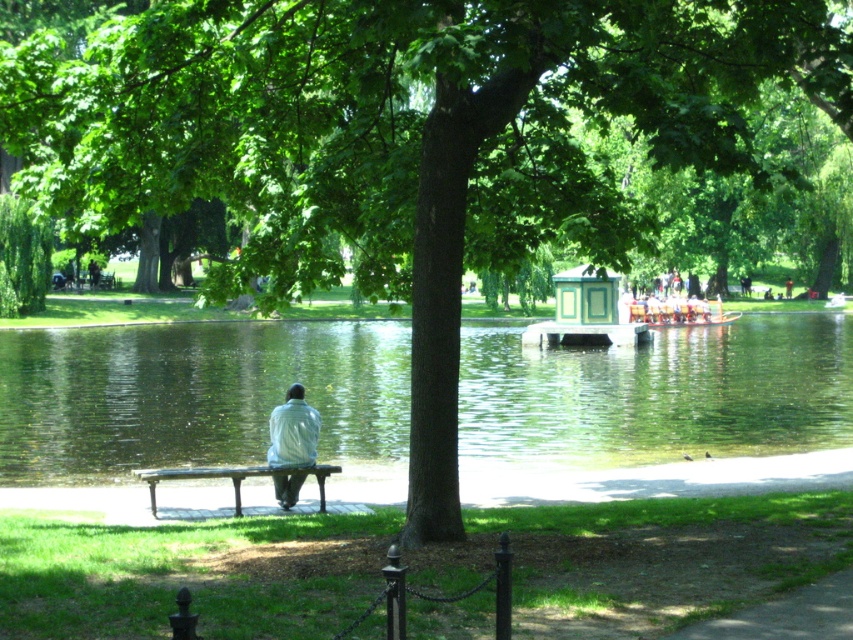
You are standing at the point labeled as point (x=195, y=396) in the park scene. What is the closest object to you at that location?

The closest object to you at point (x=195, y=396) is the green reflective water at center.

You are standing at the point marked as point (195, 396) in the park scene. According to the image, what is the surface you are currently standing on?

The point (195, 396) is on green reflective water at center, so you are standing on the green reflective water at center.

You are standing in the park and want to place a small flag at the point closer to you between point (735, 404) and point (643, 314). Which point should you choose?

You should choose point (735, 404) because it is closer to the viewer than point (643, 314).